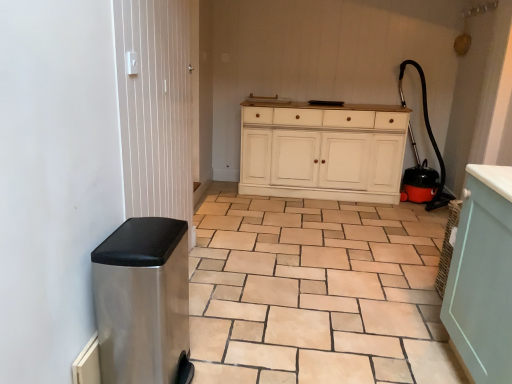
I want to click on free space behind metallic silver screen door at left, so click(221, 248).